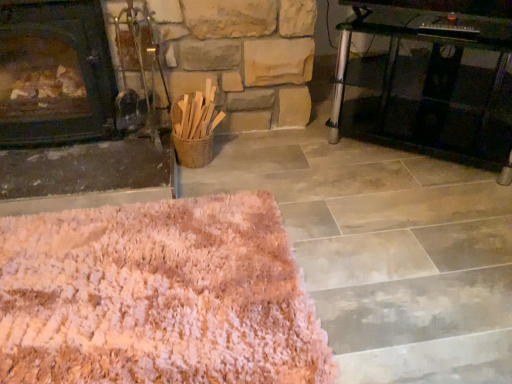
Identify the location of pink shaggy rug at lower left. (157, 296).

Locate an element on the screen. Image resolution: width=512 pixels, height=384 pixels. pink shaggy rug at lower left is located at coordinates (157, 296).

From a real-world perspective, which is physically above, dark wood fireplace at left or transparent glass table at right?

From a 3D spatial view, dark wood fireplace at left is above.

Find the location of a particular element. This screenshot has width=512, height=384. table on the right of dark wood fireplace at left is located at coordinates (431, 80).

Which of these two, dark wood fireplace at left or transparent glass table at right, stands shorter?

With less height is transparent glass table at right.

Which is more to the left, dark wood fireplace at left or transparent glass table at right?

From the viewer's perspective, dark wood fireplace at left appears more on the left side.

Between point (286, 373) and point (391, 129), which one is positioned in front?

Point (286, 373)

Measure the distance between pink shaggy rug at lower left and transparent glass table at right.

The distance of pink shaggy rug at lower left from transparent glass table at right is 3.91 feet.

Is pink shaggy rug at lower left looking in the opposite direction of transparent glass table at right?

pink shaggy rug at lower left does not have its back to transparent glass table at right.

Is pink shaggy rug at lower left wider than transparent glass table at right?

Yes.

Is transparent glass table at right turned away from dark wood fireplace at left?

No.

Does point (397, 144) appear closer or farther from the camera than point (45, 8)?

Point (397, 144).

Are transparent glass table at right and dark wood fireplace at left making contact?

No, transparent glass table at right is not beside dark wood fireplace at left.

Is transparent glass table at right positioned behind dark wood fireplace at left?

Yes, it is.

Who is shorter, pink shaggy rug at lower left or dark wood fireplace at left?

With less height is pink shaggy rug at lower left.

Considering the positions of objects pink shaggy rug at lower left and dark wood fireplace at left in the image provided, who is more to the right, pink shaggy rug at lower left or dark wood fireplace at left?

pink shaggy rug at lower left is more to the right.

Measure the distance between pink shaggy rug at lower left and dark wood fireplace at left.

pink shaggy rug at lower left and dark wood fireplace at left are 28.38 inches apart.

From the image's perspective, is pink shaggy rug at lower left above dark wood fireplace at left?

No, from the image's perspective, pink shaggy rug at lower left is not over dark wood fireplace at left.

Is transparent glass table at right behind pink shaggy rug at lower left?

Yes, it is behind pink shaggy rug at lower left.

Identify the location of table behind the pink shaggy rug at lower left. (431, 80).

Is transparent glass table at right looking in the opposite direction of pink shaggy rug at lower left?

transparent glass table at right is not turned away from pink shaggy rug at lower left.

Is transparent glass table at right far from pink shaggy rug at lower left?

Yes, transparent glass table at right and pink shaggy rug at lower left are quite far apart.

Is dark wood fireplace at left located outside pink shaggy rug at lower left?

Yes, dark wood fireplace at left is not within pink shaggy rug at lower left.

Based on their positions, is dark wood fireplace at left located to the left or right of pink shaggy rug at lower left?

dark wood fireplace at left is to the left of pink shaggy rug at lower left.

From the image's perspective, between dark wood fireplace at left and pink shaggy rug at lower left, who is located below?

pink shaggy rug at lower left.

Find the location of `fireplace lying above the pink shaggy rug at lower left (from the image's perspective)`. fireplace lying above the pink shaggy rug at lower left (from the image's perspective) is located at coordinates (55, 73).

Find the location of a particular element. Image resolution: width=512 pixels, height=384 pixels. table below the dark wood fireplace at left (from the image's perspective) is located at coordinates pos(431,80).

At what (x,y) coordinates should I click in order to perform the action: click on table above the pink shaggy rug at lower left (from the image's perspective). Please return your answer as a coordinate pair (x, y). This screenshot has height=384, width=512. Looking at the image, I should click on (431, 80).

From the image, which object appears to be farther from dark wood fireplace at left, pink shaggy rug at lower left or transparent glass table at right?

transparent glass table at right is positioned further to the anchor dark wood fireplace at left.

Which object lies nearer to the anchor point dark wood fireplace at left, transparent glass table at right or pink shaggy rug at lower left?

pink shaggy rug at lower left is positioned closer to the anchor dark wood fireplace at left.

From the image, which object appears to be nearer to transparent glass table at right, pink shaggy rug at lower left or dark wood fireplace at left?

The object closer to transparent glass table at right is pink shaggy rug at lower left.

Considering their positions, is dark wood fireplace at left positioned closer to transparent glass table at right than pink shaggy rug at lower left?

pink shaggy rug at lower left is closer to transparent glass table at right.

Estimate the real-world distances between objects in this image. Which object is closer to pink shaggy rug at lower left, transparent glass table at right or dark wood fireplace at left?

The object closer to pink shaggy rug at lower left is dark wood fireplace at left.

Which object lies further to the anchor point pink shaggy rug at lower left, dark wood fireplace at left or transparent glass table at right?

Among the two, transparent glass table at right is located further to pink shaggy rug at lower left.

What are the coordinates of `mat between dark wood fireplace at left and transparent glass table at right` in the screenshot? It's located at (157, 296).